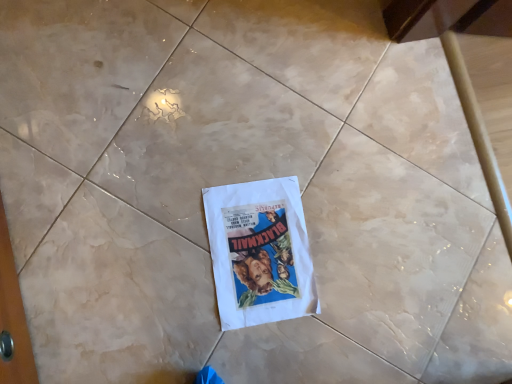
Identify the location of white paper flyer at center. The height and width of the screenshot is (384, 512). pos(260,252).

What do you see at coordinates (260, 252) in the screenshot? I see `white paper flyer at center` at bounding box center [260, 252].

Locate an element on the screen. white paper flyer at center is located at coordinates (260, 252).